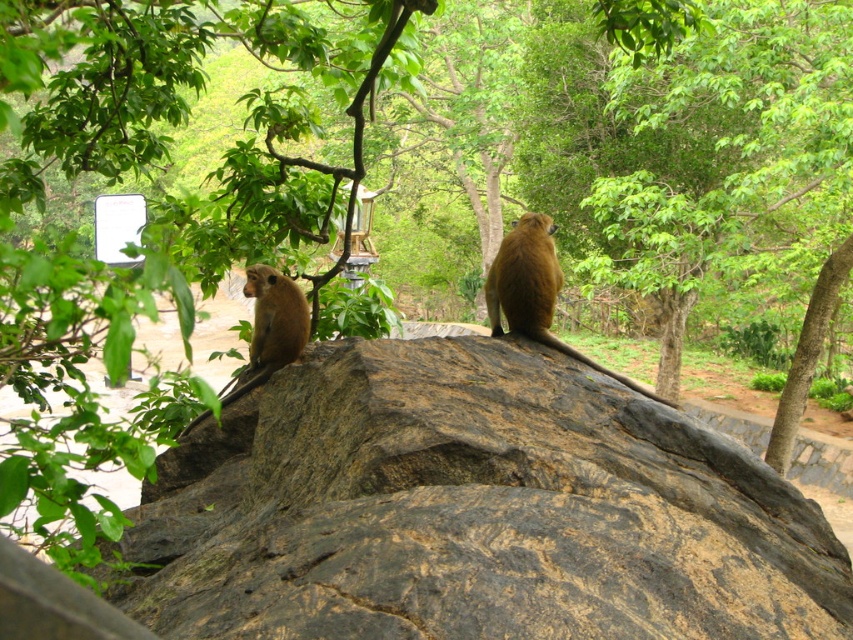
Question: Is brown rough rock at center smaller than golden fur monkey at center?

Choices:
 (A) no
 (B) yes

Answer: (A)

Question: Is brown rough rock at center closer to the viewer compared to golden fur monkey at center?

Choices:
 (A) no
 (B) yes

Answer: (B)

Question: Considering the relative positions of brown rough rock at center and golden fur monkey at center in the image provided, where is brown rough rock at center located with respect to golden fur monkey at center?

Choices:
 (A) left
 (B) right

Answer: (A)

Question: Which point is farther from the camera taking this photo?

Choices:
 (A) (339, 634)
 (B) (509, 244)

Answer: (B)

Question: Which point is farther from the camera taking this photo?

Choices:
 (A) (198, 472)
 (B) (538, 308)

Answer: (B)

Question: Which object appears farthest from the camera in this image?

Choices:
 (A) brown rough rock at center
 (B) golden fur monkey at center

Answer: (B)